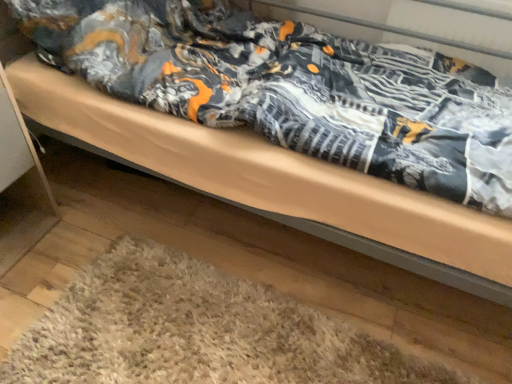
What are the coordinates of `free point below beige shaggy rug at lower center (from a real-world perspective)` in the screenshot? It's located at (206, 338).